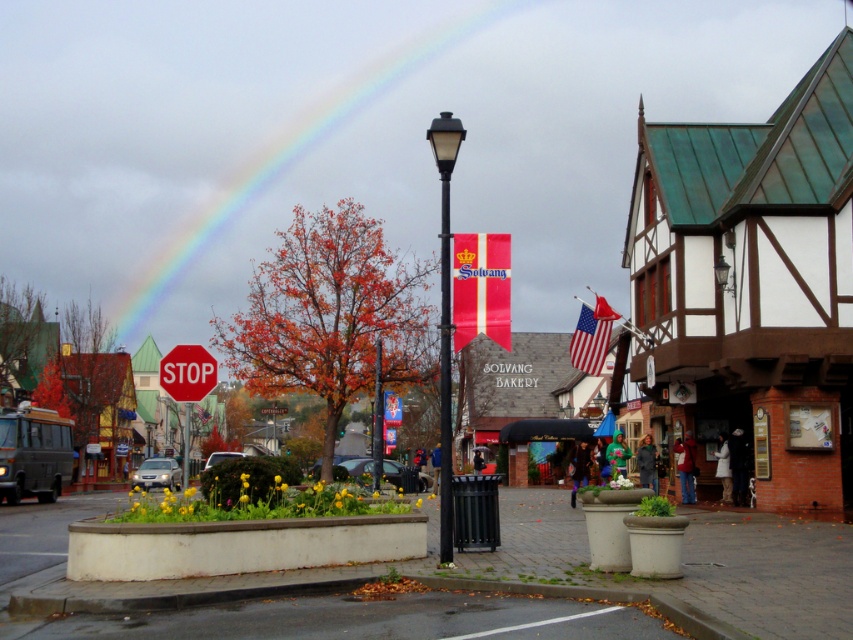
Question: Which object is farther from the camera taking this photo?

Choices:
 (A) red fabric banner at center
 (B) rainbow at upper center

Answer: (B)

Question: Which point is farther to the camera?

Choices:
 (A) (448, 412)
 (B) (581, 346)

Answer: (B)

Question: Is rainbow at upper center bigger than black metal pole at center?

Choices:
 (A) no
 (B) yes

Answer: (B)

Question: Which point is closer to the camera?

Choices:
 (A) metallic stop sign at center
 (B) red fabric banner at center
 (C) rainbow at upper center
 (D) red matte stop sign at center

Answer: (B)

Question: Is red matte stop sign at center in front of metallic stop sign at center?

Choices:
 (A) yes
 (B) no

Answer: (A)

Question: Is rainbow at upper center positioned in front of black metal pole at center?

Choices:
 (A) no
 (B) yes

Answer: (A)